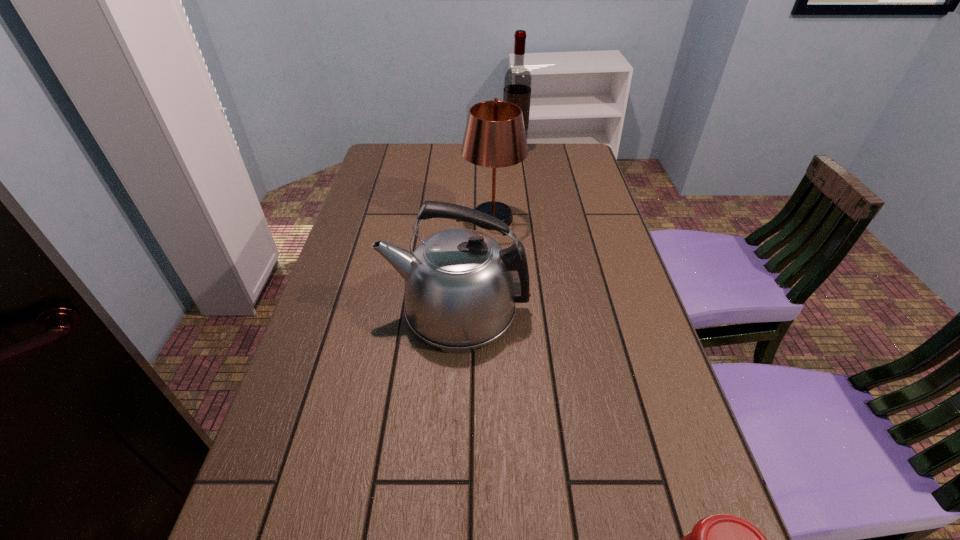
Locate which object ranks second in proximity to the lampshade. Please provide its 2D coordinates. Your answer should be formatted as a tuple, i.e. [(x, y)], where the tuple contains the x and y coordinates of a point satisfying the conditions above.

[(518, 80)]